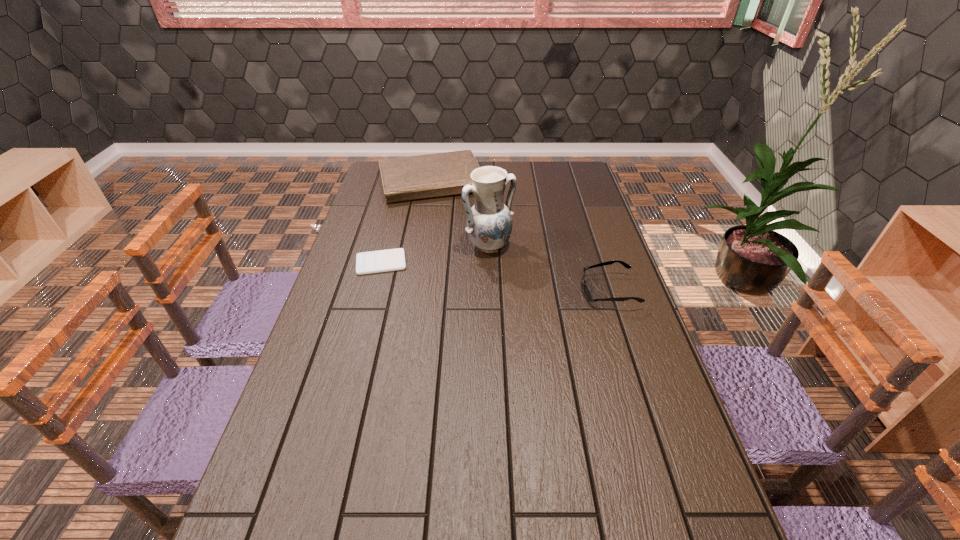
Find the location of a particular element. Image resolution: width=960 pixels, height=540 pixels. free point located on the spine side of the third shortest object is located at coordinates (468, 269).

The image size is (960, 540). I want to click on vacant area located 0.210m on the spine side of the third shortest object, so click(x=456, y=235).

Image resolution: width=960 pixels, height=540 pixels. Find the location of `blank area located on the spine side of the third shortest object`. blank area located on the spine side of the third shortest object is located at coordinates (455, 231).

You are a GUI agent. You are given a task and a screenshot of the screen. Output one action in this format:
    pyautogui.click(x=<x>, y=<y>)
    Task: Click on the free spot located 0.090m on either side of the tallest object
    
    Given the screenshot: What is the action you would take?
    pyautogui.click(x=518, y=273)

Locate an element on the screen. The height and width of the screenshot is (540, 960). vacant space situated 0.130m on either side of the tallest object is located at coordinates (525, 280).

Identify the location of vacant area located 0.390m on either side of the tallest object. Image resolution: width=960 pixels, height=540 pixels. (581, 334).

Find the location of a particular element. object that is at the far edge is located at coordinates (441, 174).

I want to click on calculator that is at the left edge, so click(x=379, y=261).

At what (x,y) coordinates should I click in order to perform the action: click on paperback book at the left edge. Please return your answer as a coordinate pair (x, y). Looking at the image, I should click on (441, 174).

Find the location of `object located at the right edge`. object located at the right edge is located at coordinates (587, 292).